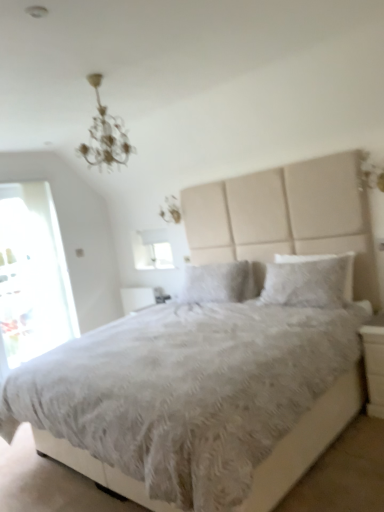
Question: Considering the relative positions of white glossy nightstand at lower right and transparent glass door at left in the image provided, is white glossy nightstand at lower right to the left or to the right of transparent glass door at left?

Choices:
 (A) left
 (B) right

Answer: (B)

Question: From a real-world perspective, is white glossy nightstand at lower right above or below transparent glass door at left?

Choices:
 (A) below
 (B) above

Answer: (A)

Question: Estimate the real-world distances between objects in this image. Which object is farther from the metallic chandelier at upper center?

Choices:
 (A) white glossy nightstand at lower right
 (B) transparent glass door at left
 (C) white fluffy pillow at center, which is the 2th pillow from back to front
 (D) white fluffy bed at center
 (E) white matte window screen at upper center

Answer: (D)

Question: Based on their relative distances, which object is nearer to the white glossy nightstand at lower right?

Choices:
 (A) white fluffy bed at center
 (B) white fluffy pillow at center, which is the 2th pillow from back to front
 (C) white matte window screen at upper center
 (D) metallic chandelier at upper center
 (E) transparent glass door at left

Answer: (B)